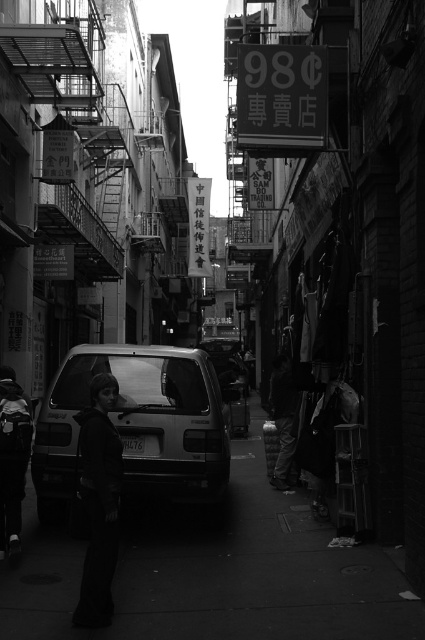
Based on the photo, can you confirm if metallic silver van at center is thinner than dark fabric jacket at center?

No.

The image size is (425, 640). I want to click on metallic silver van at center, so click(136, 424).

Which is behind, point (56, 387) or point (82, 586)?

Positioned behind is point (56, 387).

Identify the location of metallic silver van at center. Image resolution: width=425 pixels, height=640 pixels. (136, 424).

Does point (251, 492) come farther from viewer compared to point (19, 529)?

Yes, it is behind point (19, 529).

Where is `smooth concrete pavement at lower center`? smooth concrete pavement at lower center is located at coordinates (217, 573).

Locate an element on the screen. smooth concrete pavement at lower center is located at coordinates (217, 573).

Is dark gray hoodie at left below dark fabric pants at center?

No.

Between dark gray hoodie at left and dark fabric pants at center, which one is positioned higher?

dark gray hoodie at left is higher up.

Find the location of a particular element. dark gray hoodie at left is located at coordinates (13, 458).